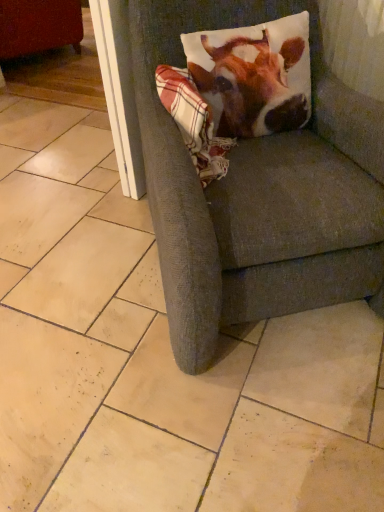
Locate an element on the screen. This screenshot has width=384, height=512. free spot in front of white glossy screen door at upper left is located at coordinates (120, 213).